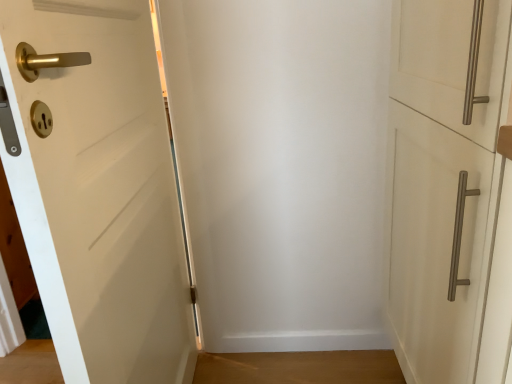
Question: In the image, is white matte cabinet handle at right, positioned as the first door in right-to-left order, on the left side or the right side of white matte door at left, the 1th door positioned from the left?

Choices:
 (A) left
 (B) right

Answer: (B)

Question: Is white matte cabinet handle at right, positioned as the second door in left-to-right order, taller or shorter than white matte door at left, the 1th door positioned from the left?

Choices:
 (A) short
 (B) tall

Answer: (A)

Question: Looking at the image, does white matte cabinet handle at right, positioned as the first door in right-to-left order, seem bigger or smaller compared to white matte door at left, the 1th door positioned from the left?

Choices:
 (A) small
 (B) big

Answer: (B)

Question: Is white matte door at left, the 1th door positioned from the left, wider or thinner than white matte cabinet handle at right, positioned as the second door in left-to-right order?

Choices:
 (A) thin
 (B) wide

Answer: (A)

Question: In terms of height, does white matte door at left, the 2th door viewed from the right, look taller or shorter compared to white matte cabinet handle at right, positioned as the second door in left-to-right order?

Choices:
 (A) tall
 (B) short

Answer: (A)

Question: Considering the positions of point [x=147, y=59] and point [x=484, y=109], is point [x=147, y=59] closer or farther from the camera than point [x=484, y=109]?

Choices:
 (A) closer
 (B) farther

Answer: (B)

Question: From the image's perspective, is white matte door at left, the 2th door viewed from the right, located above or below white matte cabinet handle at right, positioned as the first door in right-to-left order?

Choices:
 (A) below
 (B) above

Answer: (A)